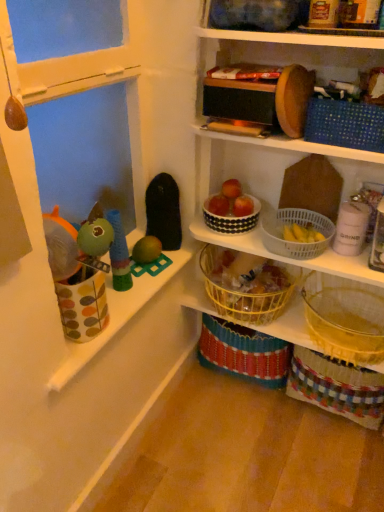
Identify the location of yellow woven basket at lower right, which appears as the 5th basket when viewed from the top. (344, 320).

You are a GUI agent. You are given a task and a screenshot of the screen. Output one action in this format:
    pyautogui.click(x=<x>, y=<y>)
    Task: Click on the white plastic basket at center-right, acting as the 3th basket starting from the top
    
    Given the screenshot: What is the action you would take?
    pyautogui.click(x=298, y=224)

How much space does yellow wire basket at center, which is counted as the second basket, starting from the bottom, occupy horizontally?

It is 13.95 inches.

What is the approximate height of polka dot fabric cup at left, the 6th toy viewed from the right?

polka dot fabric cup at left, the 6th toy viewed from the right, is 34.34 centimeters in height.

Describe the element at coordinates (119, 254) in the screenshot. The width and height of the screenshot is (384, 512). I see `green rubber toy at left, positioned as the 2th toy in left-to-right order` at that location.

In order to click on yellow woven basket at lower right, arranged as the first basket when ordered from the bottom in this screenshot , I will do `click(344, 320)`.

Is green rubber toy at center, which is the 3th toy in left-to-right order, to the left or to the right of wooden toy at upper right, which is the 4th toy in left-to-right order, in the image?

In the image, green rubber toy at center, which is the 3th toy in left-to-right order, appears on the left side of wooden toy at upper right, which is the 4th toy in left-to-right order.

Is green rubber toy at center, the 4th toy from the right, wider or thinner than wooden toy at upper right, the third toy when ordered from right to left?

green rubber toy at center, the 4th toy from the right, is wider than wooden toy at upper right, the third toy when ordered from right to left.

Which is more distant, (158, 240) or (335, 13)?

The point (158, 240) is farther.

How different are the orientations of green rubber toy at center, which is the 3th toy in left-to-right order, and wooden toy at upper right, which is the 4th toy in left-to-right order, in degrees?

The angle between the facing direction of green rubber toy at center, which is the 3th toy in left-to-right order, and the facing direction of wooden toy at upper right, which is the 4th toy in left-to-right order, is 91.4 degrees.

Can you confirm if blue dotted fabric basket at upper right, which is the 5th basket in bottom-to-top order, is bigger than red matte apple at center, which ranks as the 1th apple in right-to-left order?

Yes, blue dotted fabric basket at upper right, which is the 5th basket in bottom-to-top order, is bigger than red matte apple at center, which ranks as the 1th apple in right-to-left order.

Can we say blue dotted fabric basket at upper right, which is the 5th basket in bottom-to-top order, lies outside red matte apple at center, which appears as the third apple when viewed from the left?

Absolutely, blue dotted fabric basket at upper right, which is the 5th basket in bottom-to-top order, is external to red matte apple at center, which appears as the third apple when viewed from the left.

Is point (356, 143) positioned behind point (244, 202)?

That is False.

Is the position of blue dotted fabric basket at upper right, the 1th basket positioned from the top, less distant than that of red matte apple at center, which ranks as the 1th apple in right-to-left order?

Yes, blue dotted fabric basket at upper right, the 1th basket positioned from the top, is closer to the viewer.

Considering the relative sizes of white matte container at upper right, arranged as the 5th toy when viewed from the left, and white plastic basket at center-right, acting as the 3th basket starting from the top, in the image provided, is white matte container at upper right, arranged as the 5th toy when viewed from the left, thinner than white plastic basket at center-right, acting as the 3th basket starting from the top,?

Yes, white matte container at upper right, arranged as the 5th toy when viewed from the left, is thinner than white plastic basket at center-right, acting as the 3th basket starting from the top.

In the scene shown: Is white matte container at upper right, arranged as the 2th toy when viewed from the right, beside white plastic basket at center-right, acting as the 3th basket starting from the top?

white matte container at upper right, arranged as the 2th toy when viewed from the right, is not next to white plastic basket at center-right, acting as the 3th basket starting from the top, and they're not touching.

Which is more to the left, white matte container at upper right, arranged as the 5th toy when viewed from the left, or white plastic basket at center-right, acting as the 3th basket starting from the top?

Positioned to the left is white plastic basket at center-right, acting as the 3th basket starting from the top.

Based on their sizes in the image, would you say white matte container at upper right, arranged as the 2th toy when viewed from the right, is bigger or smaller than white plastic basket at center-right, marked as the 3th basket in a bottom-to-top arrangement?

Clearly, white matte container at upper right, arranged as the 2th toy when viewed from the right, is smaller in size than white plastic basket at center-right, marked as the 3th basket in a bottom-to-top arrangement.

Does point (340, 236) appear closer or farther from the camera than point (243, 224)?

Point (340, 236) is positioned closer to the camera compared to point (243, 224).

Considering the sizes of objects white matte container at upper right, arranged as the 2th toy when viewed from the right, and white dotted bowl at center, arranged as the fourth basket when ordered from the bottom, in the image provided, who is bigger, white matte container at upper right, arranged as the 2th toy when viewed from the right, or white dotted bowl at center, arranged as the fourth basket when ordered from the bottom,?

white dotted bowl at center, arranged as the fourth basket when ordered from the bottom, is bigger.

From the image's perspective, which one is positioned lower, white matte container at upper right, arranged as the 2th toy when viewed from the right, or white dotted bowl at center, placed as the second basket when sorted from top to bottom?

white matte container at upper right, arranged as the 2th toy when viewed from the right, is shown below in the image.

Are white matte container at upper right, arranged as the 5th toy when viewed from the left, and white dotted bowl at center, placed as the second basket when sorted from top to bottom, located far from each other?

No, white matte container at upper right, arranged as the 5th toy when viewed from the left, is not far from white dotted bowl at center, placed as the second basket when sorted from top to bottom.

Considering the sizes of objects red matte apple at center, which appears as the third apple when viewed from the left, and green rubber toy at center, the 4th toy from the right, in the image provided, who is wider, red matte apple at center, which appears as the third apple when viewed from the left, or green rubber toy at center, the 4th toy from the right,?

With larger width is green rubber toy at center, the 4th toy from the right.

At what (x,y) coordinates should I click in order to perform the action: click on apple that is the 1st object located above the green rubber toy at center, which is the 3th toy in left-to-right order (from the image's perspective). Please return your answer as a coordinate pair (x, y). This screenshot has height=512, width=384. Looking at the image, I should click on (243, 206).

How distant is red matte apple at center, which appears as the third apple when viewed from the left, from green rubber toy at center, the 4th toy from the right?

12.45 inches.

From the image's perspective, would you say red matte apple at center, which ranks as the 1th apple in right-to-left order, is shown under green rubber toy at center, the 4th toy from the right?

No, from the image's perspective, red matte apple at center, which ranks as the 1th apple in right-to-left order, is not below green rubber toy at center, the 4th toy from the right.

Considering the relative sizes of yellow wire basket at center, the 4th basket positioned from the top, and yellow woven basket at lower right, which appears as the 5th basket when viewed from the top, in the image provided, is yellow wire basket at center, the 4th basket positioned from the top, wider than yellow woven basket at lower right, which appears as the 5th basket when viewed from the top,?

Incorrect, the width of yellow wire basket at center, the 4th basket positioned from the top, does not surpass that of yellow woven basket at lower right, which appears as the 5th basket when viewed from the top.

Is yellow wire basket at center, which is counted as the second basket, starting from the bottom, in front of or behind yellow woven basket at lower right, which appears as the 5th basket when viewed from the top, in the image?

Visually, yellow wire basket at center, which is counted as the second basket, starting from the bottom, is located behind yellow woven basket at lower right, which appears as the 5th basket when viewed from the top.

Is yellow woven basket at lower right, which appears as the 5th basket when viewed from the top, at the back of yellow wire basket at center, which is counted as the second basket, starting from the bottom?

No.

Does yellow wire basket at center, the 4th basket positioned from the top, have a lesser height compared to white dotted bowl at center, placed as the second basket when sorted from top to bottom?

In fact, yellow wire basket at center, the 4th basket positioned from the top, may be taller than white dotted bowl at center, placed as the second basket when sorted from top to bottom.

From a real-world perspective, is yellow wire basket at center, which is counted as the second basket, starting from the bottom, on white dotted bowl at center, placed as the second basket when sorted from top to bottom?

No, from a real-world perspective, yellow wire basket at center, which is counted as the second basket, starting from the bottom, is not above white dotted bowl at center, placed as the second basket when sorted from top to bottom.

Identify the location of the 2nd basket above when counting from the yellow wire basket at center, which is counted as the second basket, starting from the bottom (from the image's perspective). (231, 219).

Identify the location of the 5th toy positioned below the wooden toy at upper right, the third toy when ordered from right to left (from a real-world perspective). (148, 257).

I want to click on basket above the red matte apple at center, which appears as the third apple when viewed from the left (from a real-world perspective), so click(345, 124).

Looking at the image, which one is located closer to wooden toy at upper right, which is the 4th toy in left-to-right order, blue dotted fabric basket at upper right, the 1th basket positioned from the top, or green rubber toy at left, marked as the 5th toy in a right-to-left arrangement?

The object closer to wooden toy at upper right, which is the 4th toy in left-to-right order, is blue dotted fabric basket at upper right, the 1th basket positioned from the top.

Based on their spatial positions, is red matte apple at upper center, the second apple positioned from the left, or yellow woven basket at center closer to blue dotted fabric basket at upper right, which is the 5th basket in bottom-to-top order?

yellow woven basket at center is positioned closer to the anchor blue dotted fabric basket at upper right, which is the 5th basket in bottom-to-top order.

Looking at the image, which one is located closer to white dotted bowl at center, placed as the second basket when sorted from top to bottom, polka dot fabric cup at left, the first toy from the left, or yellow woven basket at center?

The object closer to white dotted bowl at center, placed as the second basket when sorted from top to bottom, is yellow woven basket at center.

Considering their positions, is red matte apple at center, which appears as the third apple when viewed from the left, positioned further to white matte container at upper right, arranged as the 5th toy when viewed from the left, than yellow wire basket at center, which is counted as the second basket, starting from the bottom?

The object further to white matte container at upper right, arranged as the 5th toy when viewed from the left, is yellow wire basket at center, which is counted as the second basket, starting from the bottom.

When comparing their distances from red matte apple at center, which ranks as the 1th apple in right-to-left order, does blue dotted fabric basket at upper right, which is the 5th basket in bottom-to-top order, or white dotted bowl at center, placed as the second basket when sorted from top to bottom, seem further?

blue dotted fabric basket at upper right, which is the 5th basket in bottom-to-top order, is further to red matte apple at center, which ranks as the 1th apple in right-to-left order.

Which object lies further to the anchor point white plastic basket at center-right, marked as the 3th basket in a bottom-to-top arrangement, red matte apple at center, which ranks as the 1th apple in right-to-left order, or red matte apple at center, placed as the first apple when sorted from left to right?

The object further to white plastic basket at center-right, marked as the 3th basket in a bottom-to-top arrangement, is red matte apple at center, placed as the first apple when sorted from left to right.

Estimate the real-world distances between objects in this image. Which object is further from yellow woven basket at center, red matte apple at center, the 3th apple in the right-to-left sequence, or white matte container at upper right, arranged as the 2th toy when viewed from the right?

white matte container at upper right, arranged as the 2th toy when viewed from the right, is further to yellow woven basket at center.

Based on their spatial positions, is red matte apple at center, which appears as the third apple when viewed from the left, or red matte apple at upper center, the second apple positioned from the left, closer to yellow wire basket at center, the 4th basket positioned from the top?

The object closer to yellow wire basket at center, the 4th basket positioned from the top, is red matte apple at center, which appears as the third apple when viewed from the left.

Find the location of `apple between white dotted bowl at center, arranged as the fourth basket when ordered from the bottom, and red matte apple at center, which appears as the third apple when viewed from the left, in the front-back direction`. apple between white dotted bowl at center, arranged as the fourth basket when ordered from the bottom, and red matte apple at center, which appears as the third apple when viewed from the left, in the front-back direction is located at coordinates 231,189.

This screenshot has width=384, height=512. In order to click on shelf that lies between wooden toy at upper right, which is the 4th toy in left-to-right order, and green rubber toy at center, the 4th toy from the right, from top to bottom in this screenshot , I will do `click(259, 177)`.

Identify the location of toy between green rubber toy at left, marked as the 5th toy in a right-to-left arrangement, and yellow woven basket at center. This screenshot has height=512, width=384. (148, 257).

Identify the location of shelf between polka dot fabric cup at left, the 6th toy viewed from the right, and white plastic basket at center-right, acting as the 3th basket starting from the top. Image resolution: width=384 pixels, height=512 pixels. (259, 177).